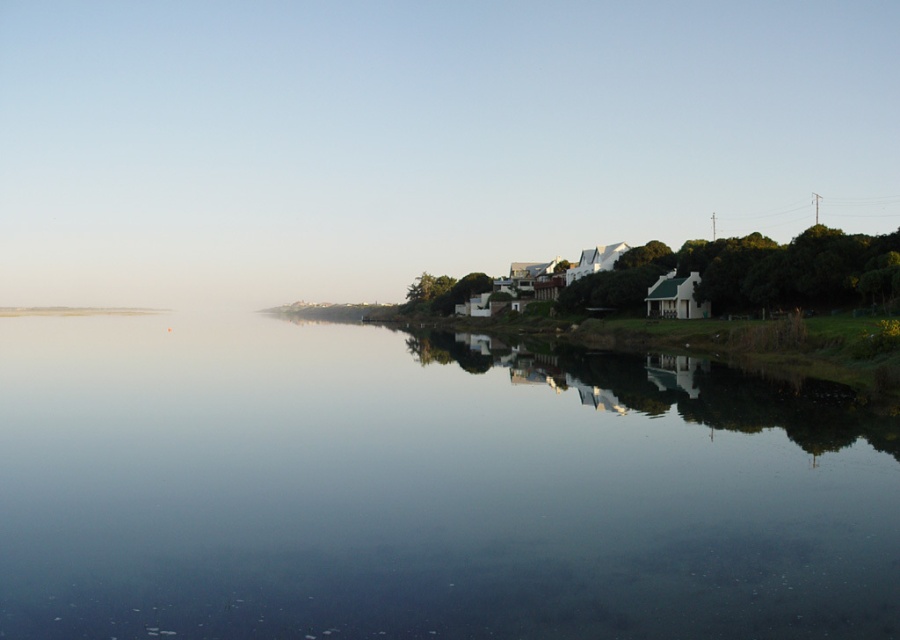
You are standing on the beach and see the transparent water at center and the green leafy tree at right. Which object appears larger in the image?

The green leafy tree at right appears larger than the transparent water at center in the image.

You are a drone operator who needs to capture a photo of both the transparent water at center and the green leafy tree at right. What is the minimum distance you need to fly between them to ensure both are in the same frame?

The minimum distance you need to fly between the transparent water at center and the green leafy tree at right is 40.99 meters, as they are 40.99 meters apart.